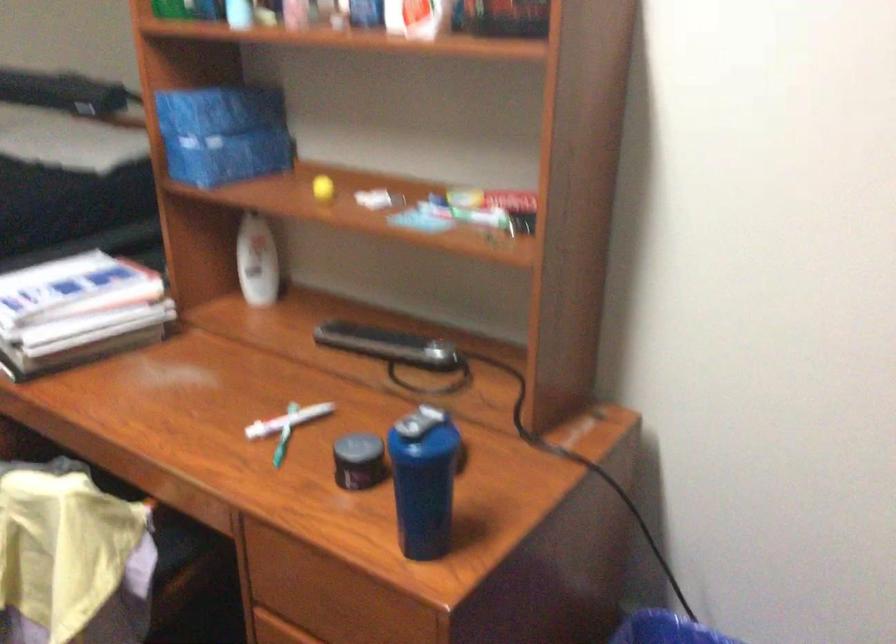
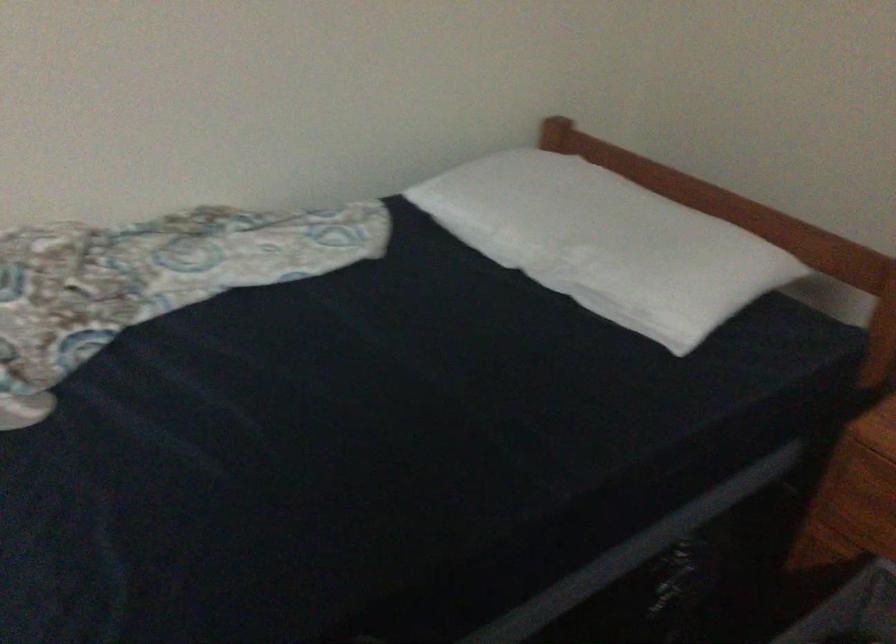
Which direction would the cameraman need to move to produce the second image?

The cameraman moved toward left, forward.